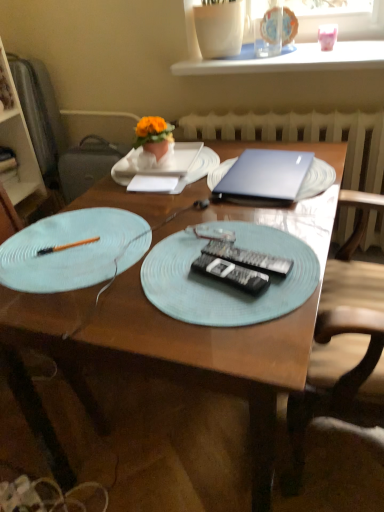
Where is `free space to the left of pink glossy piggy bank at upper right, acting as the second tableware starting from the left`? free space to the left of pink glossy piggy bank at upper right, acting as the second tableware starting from the left is located at coordinates (294, 53).